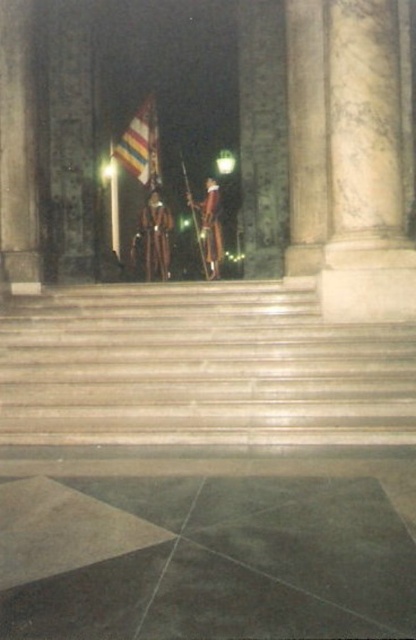
You are standing at the bottom of the smooth stone stairs at center and want to reach the top. If your walking speed is 1.2 meters per second, how many seconds will it take you to climb the stairs?

The distance between you and the smooth stone stairs at center is 7.39 meters. At a speed of 1.2 meters per second, it would take approximately 6.16 seconds to climb the stairs.

You are a visitor approaching the entrance of the building and see the striped fabric flag at center and the shiny gold helmet at center. From your perspective, which object is positioned to the left?

The striped fabric flag at center is to the left of shiny gold helmet at center.